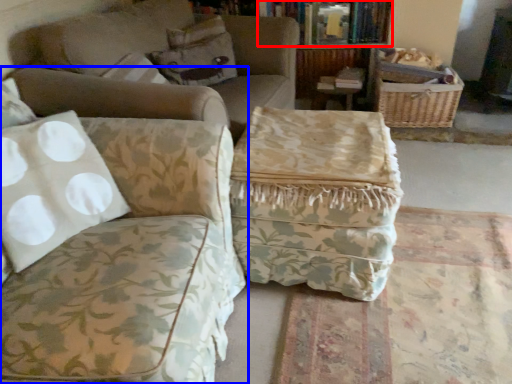
Question: Which object appears farthest to the camera in this image, book (highlighted by a red box) or studio couch (highlighted by a blue box)?

Choices:
 (A) book
 (B) studio couch

Answer: (A)